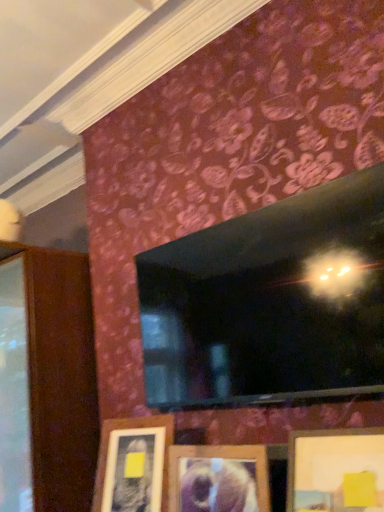
Describe the element at coordinates (133, 465) in the screenshot. I see `wooden picture frame at lower center, the 3th picture frame viewed from the right` at that location.

Find the location of a particular element. The height and width of the screenshot is (512, 384). wooden picture frame at lower center, the 3th picture frame viewed from the right is located at coordinates (133, 465).

Does point (213, 494) appear closer or farther from the camera than point (148, 441)?

Clearly, point (213, 494) is closer to the camera than point (148, 441).

From the image's perspective, is wooden picture frame at center, the second picture frame from the left, located beneath wooden picture frame at lower center, which is the first picture frame in left-to-right order?

No, from the image's perspective, wooden picture frame at center, the second picture frame from the left, is not below wooden picture frame at lower center, which is the first picture frame in left-to-right order.

What's the angular difference between wooden picture frame at center, the second picture frame positioned from the right, and wooden picture frame at lower center, the 3th picture frame viewed from the right,'s facing directions?

They differ by 10.8 degrees in their facing directions.

Image resolution: width=384 pixels, height=512 pixels. Identify the location of picture frame that appears on the left of wooden picture frame at center, the second picture frame from the left. (133, 465).

Is point (299, 434) closer to camera compared to point (159, 503)?

Yes, point (299, 434) is in front of point (159, 503).

What's the angular difference between wooden picture frame at lower center, which ranks as the 3th picture frame in left-to-right order, and wooden picture frame at lower center, the 3th picture frame viewed from the right,'s facing directions?

5.94 degrees.

Consider the image. Which is more to the left, wooden picture frame at lower center, the first picture frame viewed from the right, or wooden picture frame at lower center, which is the first picture frame in left-to-right order?

wooden picture frame at lower center, which is the first picture frame in left-to-right order, is more to the left.

From the image's perspective, which one is positioned higher, wooden picture frame at lower center, the first picture frame viewed from the right, or wooden picture frame at lower center, the 3th picture frame viewed from the right?

wooden picture frame at lower center, the first picture frame viewed from the right, from the image's perspective.

Which of these two, wooden picture frame at lower center, which is the first picture frame in left-to-right order, or wooden picture frame at lower center, which ranks as the 3th picture frame in left-to-right order, is thinner?

wooden picture frame at lower center, which is the first picture frame in left-to-right order, is thinner.

Is wooden picture frame at lower center, the 3th picture frame viewed from the right, not near wooden picture frame at lower center, the first picture frame viewed from the right?

wooden picture frame at lower center, the 3th picture frame viewed from the right, is actually quite close to wooden picture frame at lower center, the first picture frame viewed from the right.

Can you confirm if wooden picture frame at lower center, the 3th picture frame viewed from the right, is taller than wooden picture frame at lower center, the first picture frame viewed from the right?

Correct, wooden picture frame at lower center, the 3th picture frame viewed from the right, is much taller as wooden picture frame at lower center, the first picture frame viewed from the right.

Considering the positions of objects wooden picture frame at lower center, which ranks as the 3th picture frame in left-to-right order, and wooden picture frame at center, the second picture frame positioned from the right, in the image provided, who is more to the right, wooden picture frame at lower center, which ranks as the 3th picture frame in left-to-right order, or wooden picture frame at center, the second picture frame positioned from the right,?

wooden picture frame at lower center, which ranks as the 3th picture frame in left-to-right order, is more to the right.

Considering the relative sizes of wooden picture frame at lower center, the first picture frame viewed from the right, and wooden picture frame at center, the second picture frame positioned from the right, in the image provided, is wooden picture frame at lower center, the first picture frame viewed from the right, taller than wooden picture frame at center, the second picture frame positioned from the right,?

Yes.

Does wooden picture frame at lower center, which ranks as the 3th picture frame in left-to-right order, lie behind wooden picture frame at center, the second picture frame positioned from the right?

That is False.

From a real-world perspective, is wooden picture frame at lower center, which ranks as the 3th picture frame in left-to-right order, positioned under wooden picture frame at center, the second picture frame from the left, based on gravity?

No, from a real-world perspective, wooden picture frame at lower center, which ranks as the 3th picture frame in left-to-right order, is not under wooden picture frame at center, the second picture frame from the left.

Which of these two, wooden picture frame at center, the second picture frame positioned from the right, or wooden picture frame at lower center, which ranks as the 3th picture frame in left-to-right order, is wider?

Wider between the two is wooden picture frame at lower center, which ranks as the 3th picture frame in left-to-right order.

Would you consider wooden picture frame at center, the second picture frame positioned from the right, to be distant from wooden picture frame at lower center, the first picture frame viewed from the right?

wooden picture frame at center, the second picture frame positioned from the right, is near wooden picture frame at lower center, the first picture frame viewed from the right, not far away.

Measure the distance between wooden picture frame at center, the second picture frame positioned from the right, and wooden picture frame at lower center, the first picture frame viewed from the right.

The distance of wooden picture frame at center, the second picture frame positioned from the right, from wooden picture frame at lower center, the first picture frame viewed from the right, is 22.38 centimeters.

Which object is closer to the camera, wooden picture frame at center, the second picture frame from the left, or wooden picture frame at lower center, the first picture frame viewed from the right?

wooden picture frame at lower center, the first picture frame viewed from the right, is more forward.

Do you think wooden picture frame at lower center, the 3th picture frame viewed from the right, is within wooden picture frame at center, the second picture frame positioned from the right, or outside of it?

wooden picture frame at lower center, the 3th picture frame viewed from the right, is spatially situated outside wooden picture frame at center, the second picture frame positioned from the right.

From a real-world perspective, is wooden picture frame at lower center, the 3th picture frame viewed from the right, on top of wooden picture frame at center, the second picture frame from the left?

Yes, from a real-world perspective, wooden picture frame at lower center, the 3th picture frame viewed from the right, is above wooden picture frame at center, the second picture frame from the left.

From the image's perspective, is wooden picture frame at lower center, which is the first picture frame in left-to-right order, under wooden picture frame at center, the second picture frame from the left?

Yes, from the image's perspective, wooden picture frame at lower center, which is the first picture frame in left-to-right order, is beneath wooden picture frame at center, the second picture frame from the left.

Is wooden picture frame at lower center, the 3th picture frame viewed from the right, wider than wooden picture frame at center, the second picture frame from the left?

Correct, the width of wooden picture frame at lower center, the 3th picture frame viewed from the right, exceeds that of wooden picture frame at center, the second picture frame from the left.

Locate an element on the screen. picture frame below the wooden picture frame at lower center, the 3th picture frame viewed from the right (from a real-world perspective) is located at coordinates (218, 479).

Where is `picture frame that is the 2nd object located below the wooden picture frame at lower center, the first picture frame viewed from the right (from the image's perspective)`? Image resolution: width=384 pixels, height=512 pixels. picture frame that is the 2nd object located below the wooden picture frame at lower center, the first picture frame viewed from the right (from the image's perspective) is located at coordinates (133, 465).

Considering their positions, is wooden picture frame at lower center, the 3th picture frame viewed from the right, positioned closer to wooden picture frame at center, the second picture frame from the left, than wooden picture frame at lower center, which ranks as the 3th picture frame in left-to-right order?

Among the two, wooden picture frame at lower center, the 3th picture frame viewed from the right, is located nearer to wooden picture frame at center, the second picture frame from the left.

Based on their spatial positions, is wooden picture frame at lower center, which ranks as the 3th picture frame in left-to-right order, or wooden picture frame at center, the second picture frame positioned from the right, closer to wooden picture frame at lower center, which is the first picture frame in left-to-right order?

wooden picture frame at center, the second picture frame positioned from the right, lies closer to wooden picture frame at lower center, which is the first picture frame in left-to-right order, than the other object.

Which object lies nearer to the anchor point wooden picture frame at lower center, which is the first picture frame in left-to-right order, wooden picture frame at center, the second picture frame positioned from the right, or wooden picture frame at lower center, the first picture frame viewed from the right?

The object closer to wooden picture frame at lower center, which is the first picture frame in left-to-right order, is wooden picture frame at center, the second picture frame positioned from the right.

Considering their positions, is wooden picture frame at lower center, which ranks as the 3th picture frame in left-to-right order, positioned closer to wooden picture frame at center, the second picture frame positioned from the right, than wooden picture frame at lower center, which is the first picture frame in left-to-right order?

wooden picture frame at lower center, which is the first picture frame in left-to-right order, lies closer to wooden picture frame at center, the second picture frame positioned from the right, than the other object.

Looking at the image, which one is located closer to wooden picture frame at lower center, which ranks as the 3th picture frame in left-to-right order, wooden picture frame at lower center, the 3th picture frame viewed from the right, or wooden picture frame at center, the second picture frame positioned from the right?

wooden picture frame at center, the second picture frame positioned from the right, lies closer to wooden picture frame at lower center, which ranks as the 3th picture frame in left-to-right order, than the other object.

Looking at the image, which one is located further to wooden picture frame at lower center, the first picture frame viewed from the right, wooden picture frame at center, the second picture frame positioned from the right, or wooden picture frame at lower center, the 3th picture frame viewed from the right?

wooden picture frame at lower center, the 3th picture frame viewed from the right, is positioned further to the anchor wooden picture frame at lower center, the first picture frame viewed from the right.

Where is `picture frame between wooden picture frame at lower center, which is the first picture frame in left-to-right order, and wooden picture frame at lower center, which ranks as the 3th picture frame in left-to-right order, in the horizontal direction`? picture frame between wooden picture frame at lower center, which is the first picture frame in left-to-right order, and wooden picture frame at lower center, which ranks as the 3th picture frame in left-to-right order, in the horizontal direction is located at coordinates (218, 479).